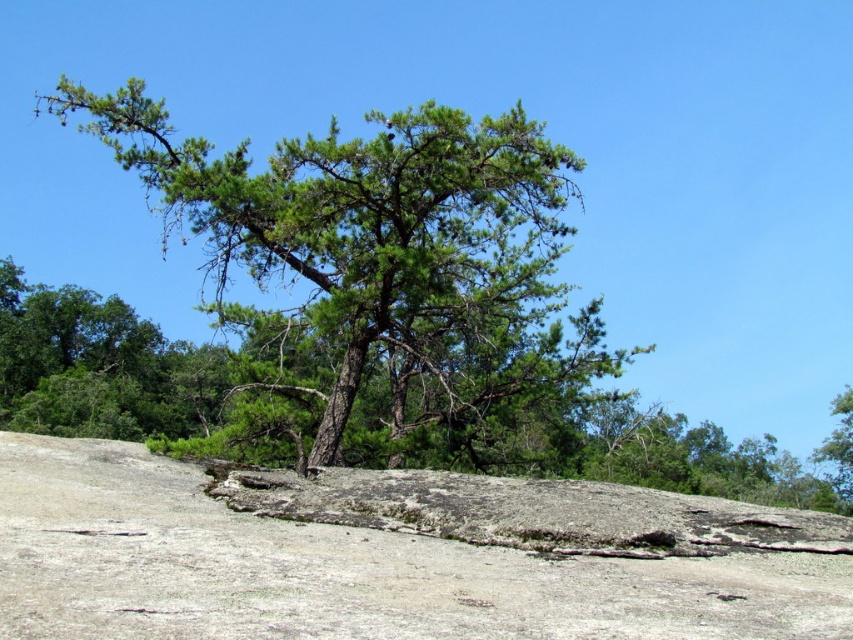
This screenshot has height=640, width=853. What do you see at coordinates (378, 280) in the screenshot?
I see `green needle-like at center` at bounding box center [378, 280].

How much distance is there between green needle-like at center and gray rock at center?

They are 47.34 feet apart.

Locate an element on the screen. The image size is (853, 640). green needle-like at center is located at coordinates (378, 280).

Locate an element on the screen. The image size is (853, 640). green needle-like at center is located at coordinates (378, 280).

Can you confirm if gray rock at center is bigger than green leafy tree at upper right?

No.

Can you confirm if gray rock at center is wider than green leafy tree at upper right?

No.

Which is behind, point (753, 556) or point (837, 397)?

The point (837, 397) is behind.

Find the location of a particular element. gray rock at center is located at coordinates (340, 570).

Does green needle-like at center have a lesser width compared to green leafy tree at upper right?

No.

Is green needle-like at center further to camera compared to green leafy tree at upper right?

No, it is not.

The width and height of the screenshot is (853, 640). I want to click on green needle-like at center, so click(x=378, y=280).